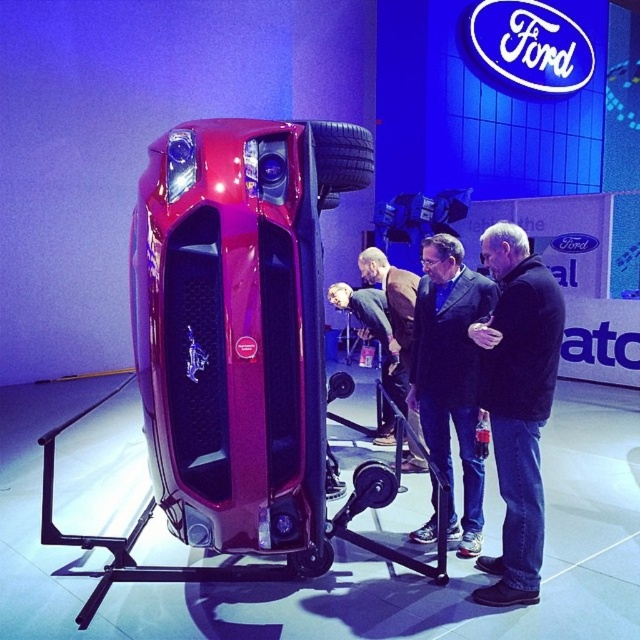
You are standing in the automotive exhibition and want to take a photo of both tires. Which tire, the black rubber tire at upper center or the black rubber tire at lower center, will appear larger in your photo?

The black rubber tire at upper center will appear larger in the photo because it is closer to the viewer than the black rubber tire at lower center.